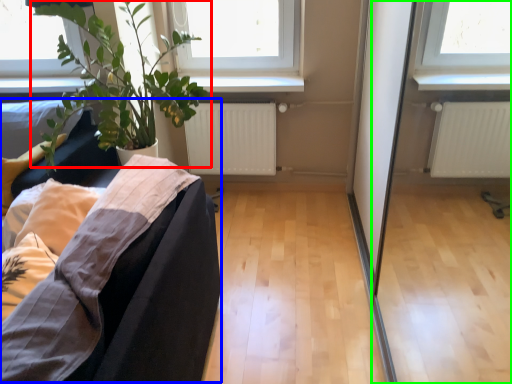
Question: Which is nearer to the houseplant (highlighted by a red box)? couch (highlighted by a blue box) or screen door (highlighted by a green box).

Choices:
 (A) couch
 (B) screen door

Answer: (A)